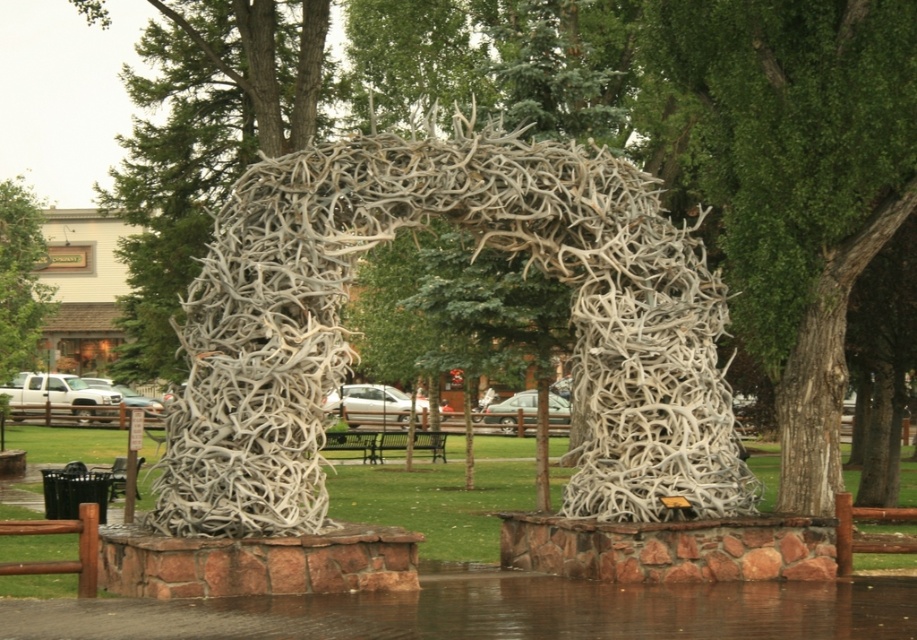
You are a landscape architect planning to add a new tree to the park. You want to ensure that the new tree will not block the view of the sculpture archway. Considering the existing green leafy tree at center and green leafy tree at upper left, which tree has a narrower width and would be a better reference for the new tree to avoid blocking the view?

The green leafy tree at center has a narrower width compared to the green leafy tree at upper left. Therefore, the new tree should be planted with a width similar to the green leafy tree at center to avoid blocking the view of the sculpture archway.

You are planning to place a bench under the white antler arch at center so visitors can sit and admire it. However, there is a green leafy tree at upper left nearby. Considering their widths, which one has a narrower base to ensure the bench fits comfortably without obstruction?

The white antler arch at center has a narrower width compared to the green leafy tree at upper left, so placing the bench under it should provide enough space without obstruction.

You are a visitor at the park and want to take a photo of the white antler arch at center without any obstructions. Since the green leafy tree at upper left is nearby, will the tree block the view of the arch?

The white antler arch at center is positioned under the green leafy tree at upper left, so the tree might block part of the arch in your photo.